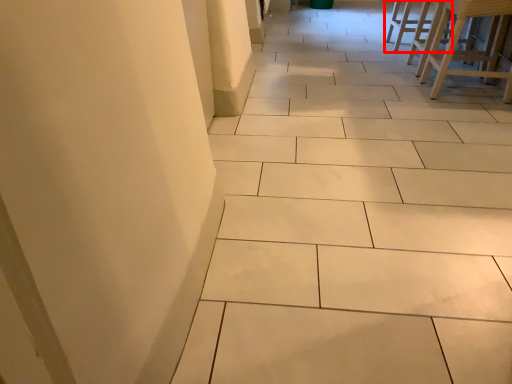
Question: From the image's perspective, considering the relative positions of furniture (annotated by the red box) and furniture in the image provided, where is furniture (annotated by the red box) located with respect to the staircase?

Choices:
 (A) below
 (B) above

Answer: (B)